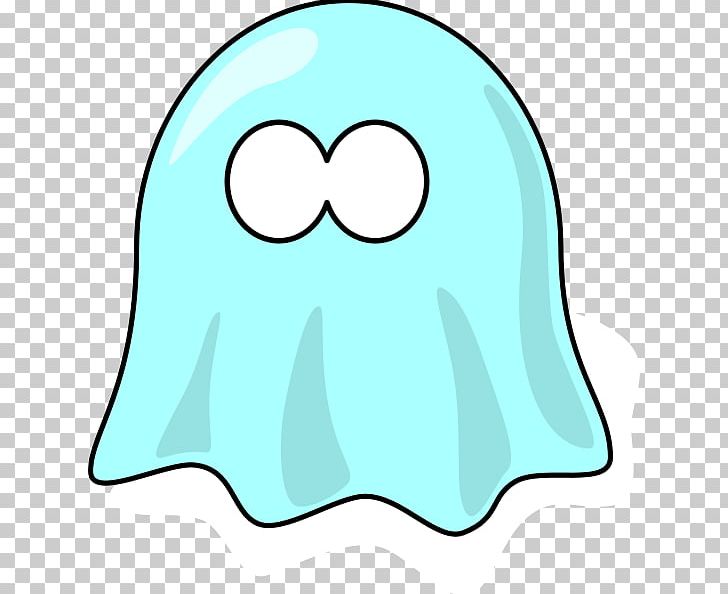
What are the coordinates of `the bottom rippled hem of sheet` in the screenshot? It's located at coord(89,476), coord(261,530), coord(461,533), coord(608,467).